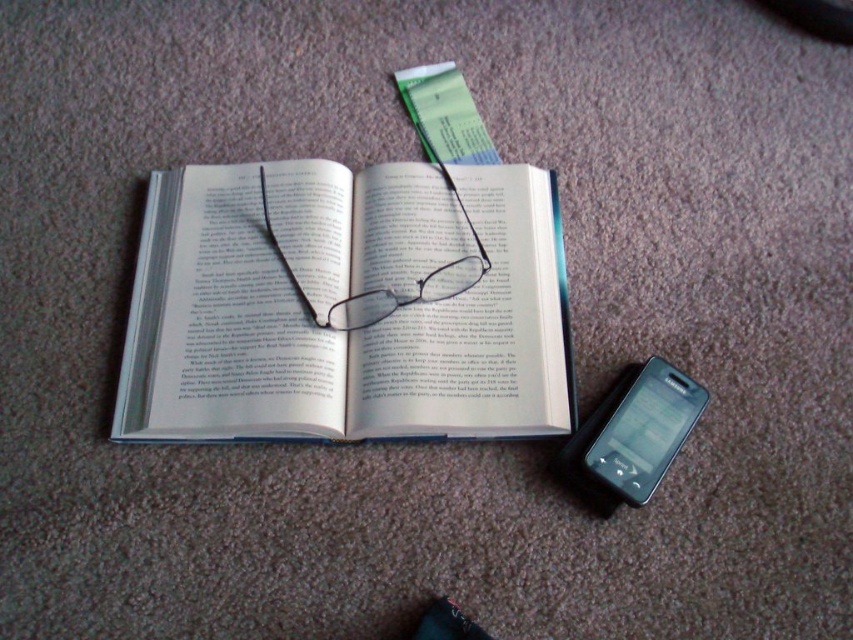
Question: Which point appears farthest from the camera in this image?

Choices:
 (A) (392, 412)
 (B) (648, 376)
 (C) (352, 301)

Answer: (C)

Question: Does matte black smartphone at lower right have a larger size compared to transparent plastic glasses at center?

Choices:
 (A) no
 (B) yes

Answer: (A)

Question: Is matte black smartphone at lower right below transparent plastic glasses at center?

Choices:
 (A) yes
 (B) no

Answer: (A)

Question: Does white paper at center have a smaller size compared to matte black smartphone at lower right?

Choices:
 (A) no
 (B) yes

Answer: (A)

Question: Which of the following is the closest to the observer?

Choices:
 (A) (111, 433)
 (B) (666, 445)
 (C) (283, 269)

Answer: (B)

Question: Which object is closer to the camera taking this photo?

Choices:
 (A) transparent plastic glasses at center
 (B) white paper at center

Answer: (B)